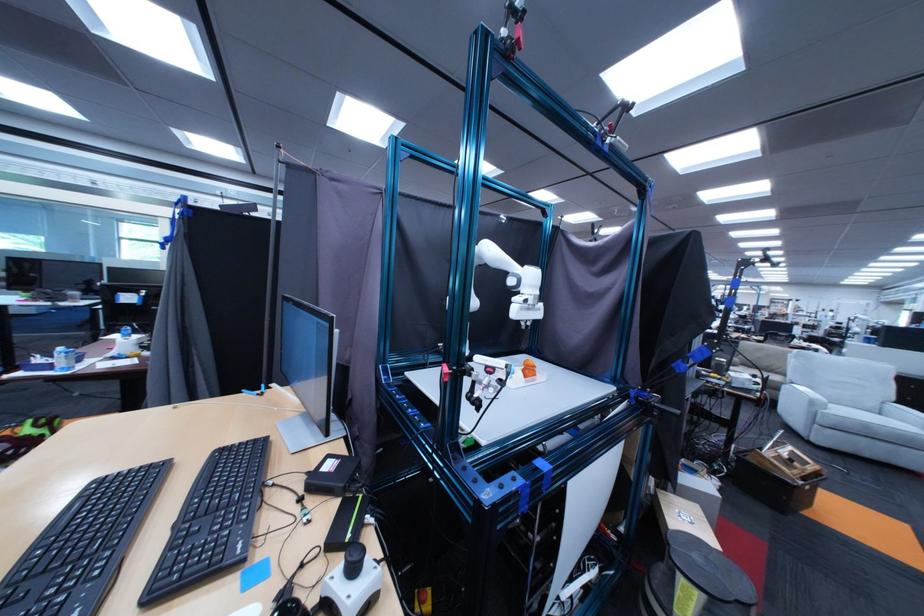
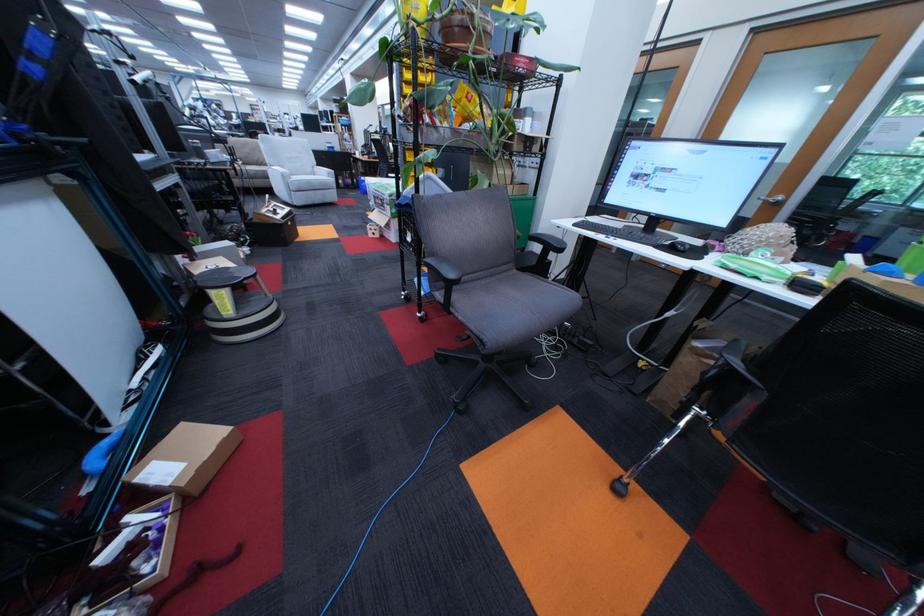
Locate, in the second image, the point that corresponds to point (827, 405) in the first image.

(298, 177)